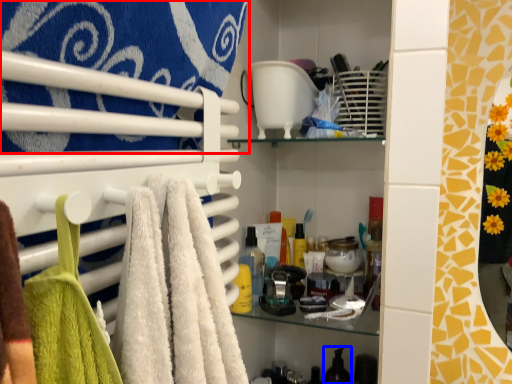
Question: Which point is further to the camera, towel (highlighted by a red box) or toiletry (highlighted by a blue box)?

Choices:
 (A) towel
 (B) toiletry

Answer: (B)